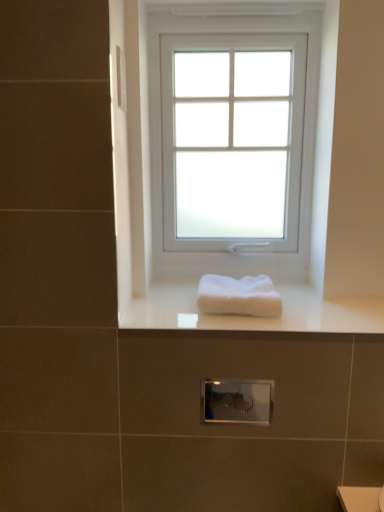
Question: Is white fluffy towel at center located outside white glossy towel at center?

Choices:
 (A) no
 (B) yes

Answer: (B)

Question: Is white fluffy towel at center closer to camera compared to white glossy towel at center?

Choices:
 (A) yes
 (B) no

Answer: (B)

Question: Can you confirm if white fluffy towel at center is shorter than white glossy towel at center?

Choices:
 (A) yes
 (B) no

Answer: (B)

Question: Can you confirm if white fluffy towel at center is positioned to the right of white glossy towel at center?

Choices:
 (A) yes
 (B) no

Answer: (B)

Question: Is white fluffy towel at center further to camera compared to white glossy towel at center?

Choices:
 (A) no
 (B) yes

Answer: (B)

Question: From a real-world perspective, relative to white glossy towel at center, is white frosted glass window at center vertically above or below?

Choices:
 (A) above
 (B) below

Answer: (A)

Question: Is white frosted glass window at center wider or thinner than white glossy towel at center?

Choices:
 (A) thin
 (B) wide

Answer: (A)

Question: From the image's perspective, relative to white glossy towel at center, is white frosted glass window at center above or below?

Choices:
 (A) below
 (B) above

Answer: (B)

Question: Would you say white frosted glass window at center is inside or outside white glossy towel at center?

Choices:
 (A) outside
 (B) inside

Answer: (A)

Question: Would you say white glossy towel at center is to the left or to the right of white fluffy towel at center in the picture?

Choices:
 (A) left
 (B) right

Answer: (B)

Question: From a real-world perspective, relative to white fluffy towel at center, is white glossy towel at center vertically above or below?

Choices:
 (A) above
 (B) below

Answer: (B)

Question: Is white glossy towel at center situated inside white fluffy towel at center or outside?

Choices:
 (A) outside
 (B) inside

Answer: (A)

Question: From the image's perspective, is white glossy towel at center above or below white fluffy towel at center?

Choices:
 (A) above
 (B) below

Answer: (B)

Question: Is white frosted glass window at center spatially inside white fluffy towel at center, or outside of it?

Choices:
 (A) inside
 (B) outside

Answer: (B)

Question: Considering the positions of point (168, 264) and point (216, 283), is point (168, 264) closer or farther from the camera than point (216, 283)?

Choices:
 (A) farther
 (B) closer

Answer: (A)